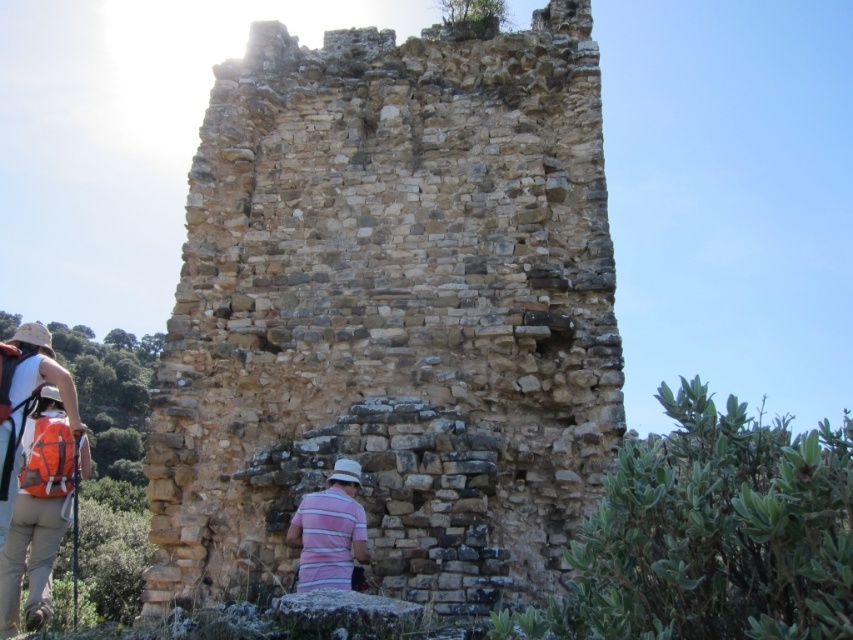
Does brown stone ruins at center have a lesser height compared to striped cotton shirt at lower left?

No.

In the scene shown: Which of these two, brown stone ruins at center or striped cotton shirt at lower left, stands shorter?

striped cotton shirt at lower left

Image resolution: width=853 pixels, height=640 pixels. Identify the location of brown stone ruins at center. (392, 312).

Where is `brown stone ruins at center`? The image size is (853, 640). brown stone ruins at center is located at coordinates (392, 312).

Can you confirm if striped cotton shirt at lower left is taller than pink striped shirt at center?

Yes.

Between point (38, 442) and point (334, 525), which one is positioned behind?

The point (38, 442) is more distant.

This screenshot has height=640, width=853. Describe the element at coordinates (39, 515) in the screenshot. I see `striped cotton shirt at lower left` at that location.

Find the location of `striped cotton shirt at lower left`. striped cotton shirt at lower left is located at coordinates (39, 515).

Does brown stone ruins at center have a greater width compared to pink striped shirt at center?

Correct, the width of brown stone ruins at center exceeds that of pink striped shirt at center.

You are a GUI agent. You are given a task and a screenshot of the screen. Output one action in this format:
    pyautogui.click(x=<x>, y=<y>)
    Task: Click on the brown stone ruins at center
    This screenshot has width=853, height=640.
    Given the screenshot: What is the action you would take?
    pyautogui.click(x=392, y=312)

Who is more forward, (389, 396) or (355, 461)?

Positioned in front is point (355, 461).

The height and width of the screenshot is (640, 853). Identify the location of brown stone ruins at center. (392, 312).